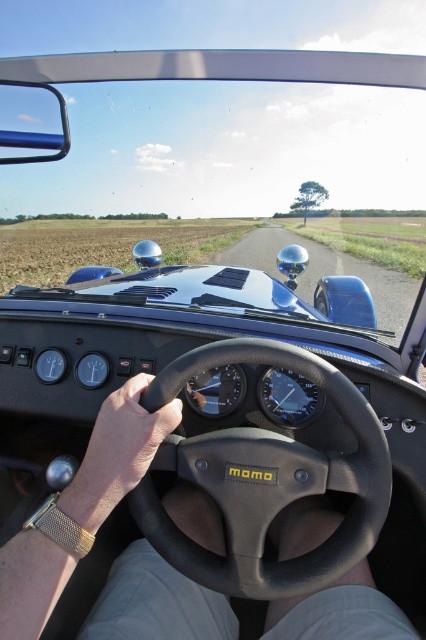
Question: Which object is closer to the camera taking this photo?

Choices:
 (A) leather at center
 (B) black leather steering wheel at center

Answer: (A)

Question: Is black leather steering wheel at center to the left of leather at center from the viewer's perspective?

Choices:
 (A) yes
 (B) no

Answer: (B)

Question: Is black leather steering wheel at center to the right of leather at center from the viewer's perspective?

Choices:
 (A) no
 (B) yes

Answer: (B)

Question: Is black leather steering wheel at center below leather at center?

Choices:
 (A) yes
 (B) no

Answer: (A)